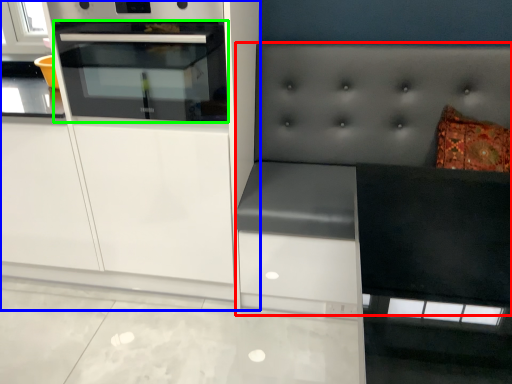
Question: Which is farther away from couch (highlighted by a red box)? cabinetry (highlighted by a blue box) or oven (highlighted by a green box)?

Choices:
 (A) cabinetry
 (B) oven

Answer: (B)